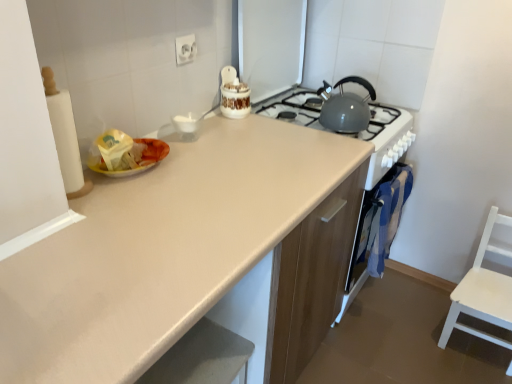
What are the coordinates of `blue fabric oven at right` in the screenshot? It's located at (378, 228).

The height and width of the screenshot is (384, 512). In order to click on matte gray kettle at upper right in this screenshot , I will do `click(345, 107)`.

Locate an element on the screen. The image size is (512, 384). white wood chair at right is located at coordinates (483, 292).

This screenshot has width=512, height=384. Find the location of `white plastic electric outlet at upper center`. white plastic electric outlet at upper center is located at coordinates (185, 49).

From a real-world perspective, is white wood chair at right located higher than white plastic electric outlet at upper center?

No.

From the image's perspective, is white wood chair at right positioned above or below white plastic electric outlet at upper center?

From the image's perspective, white wood chair at right appears below white plastic electric outlet at upper center.

Between point (479, 289) and point (192, 37), which one is positioned behind?

The point (479, 289) is farther from the camera.

Considering the positions of objects white wood chair at right and white plastic electric outlet at upper center in the image provided, who is more to the right, white wood chair at right or white plastic electric outlet at upper center?

From the viewer's perspective, white wood chair at right appears more on the right side.

Does white wood chair at right lie behind blue fabric oven at right?

That is False.

Is white wood chair at right oriented away from blue fabric oven at right?

No, white wood chair at right is not facing the opposite direction of blue fabric oven at right.

In terms of height, does matte gray kettle at upper right look taller or shorter compared to white plastic electric outlet at upper center?

matte gray kettle at upper right is taller than white plastic electric outlet at upper center.

Considering the relative positions of matte gray kettle at upper right and white plastic electric outlet at upper center in the image provided, is matte gray kettle at upper right behind white plastic electric outlet at upper center?

That is True.

In the scene shown: Does matte gray kettle at upper right appear on the right side of white plastic electric outlet at upper center?

Correct, you'll find matte gray kettle at upper right to the right of white plastic electric outlet at upper center.

Where is `kitchen appliance below the white plastic electric outlet at upper center (from the image's perspective)`? Image resolution: width=512 pixels, height=384 pixels. kitchen appliance below the white plastic electric outlet at upper center (from the image's perspective) is located at coordinates (345, 107).

Are white wood chair at right and matte beige countertop at center located far from each other?

Yes.

Looking at this image, is white wood chair at right in front of or behind matte beige countertop at center in the image?

white wood chair at right is behind matte beige countertop at center.

Considering the sizes of objects white wood chair at right and matte beige countertop at center in the image provided, who is shorter, white wood chair at right or matte beige countertop at center?

Standing shorter between the two is white wood chair at right.

Which object is positioned more to the left, white wood chair at right or matte beige countertop at center?

From the viewer's perspective, matte beige countertop at center appears more on the left side.

From the image's perspective, between matte beige countertop at center and white wood chair at right, which one is located above?

matte beige countertop at center, from the image's perspective.

Between matte beige countertop at center and white wood chair at right, which one has larger width?

Wider between the two is matte beige countertop at center.

Identify the location of countertop on the left of the white wood chair at right. coord(166,253).

Is point (195, 317) closer or farther from the camera than point (487, 339)?

Point (195, 317) appears to be closer to the viewer than point (487, 339).

Is matte gray kettle at upper right placed right next to matte beige countertop at center?

matte gray kettle at upper right and matte beige countertop at center are not in contact.

From a real-world perspective, is matte gray kettle at upper right physically below matte beige countertop at center?

No, from a real-world perspective, matte gray kettle at upper right is not below matte beige countertop at center.

Is matte gray kettle at upper right at the right side of matte beige countertop at center?

Indeed, matte gray kettle at upper right is positioned on the right side of matte beige countertop at center.

Do you think matte gray kettle at upper right is within matte beige countertop at center, or outside of it?

matte gray kettle at upper right is outside matte beige countertop at center.

Does white wood chair at right have a lesser width compared to matte gray kettle at upper right?

No, white wood chair at right is not thinner than matte gray kettle at upper right.

Considering the positions of objects white wood chair at right and matte gray kettle at upper right in the image provided, who is more to the right, white wood chair at right or matte gray kettle at upper right?

white wood chair at right.

Which of these two, white wood chair at right or matte gray kettle at upper right, stands shorter?

matte gray kettle at upper right.

From a real-world perspective, is white wood chair at right below matte gray kettle at upper right?

Correct, in the physical world, white wood chair at right is lower than matte gray kettle at upper right.

At what (x,y) coordinates should I click in order to perform the action: click on electric outlet in front of the white wood chair at right. Please return your answer as a coordinate pair (x, y). Image resolution: width=512 pixels, height=384 pixels. Looking at the image, I should click on (185, 49).

Find the location of `chair that appears below the blue fabric oven at right (from the image's perspective)`. chair that appears below the blue fabric oven at right (from the image's perspective) is located at coordinates (483, 292).

Based on their spatial positions, is white plastic electric outlet at upper center or matte gray kettle at upper right closer to matte beige countertop at center?

matte gray kettle at upper right.

Estimate the real-world distances between objects in this image. Which object is closer to matte gray kettle at upper right, blue fabric oven at right or white plastic electric outlet at upper center?

blue fabric oven at right lies closer to matte gray kettle at upper right than the other object.

Estimate the real-world distances between objects in this image. Which object is closer to white plastic electric outlet at upper center, matte gray kettle at upper right or matte beige countertop at center?

matte gray kettle at upper right lies closer to white plastic electric outlet at upper center than the other object.

Which object lies further to the anchor point white wood chair at right, blue fabric oven at right or white plastic electric outlet at upper center?

white plastic electric outlet at upper center is further to white wood chair at right.

When comparing their distances from matte gray kettle at upper right, does white wood chair at right or matte beige countertop at center seem closer?

matte beige countertop at center.

Looking at the image, which one is located closer to matte beige countertop at center, blue fabric oven at right or white plastic electric outlet at upper center?

blue fabric oven at right is positioned closer to the anchor matte beige countertop at center.

Estimate the real-world distances between objects in this image. Which object is further from white plastic electric outlet at upper center, blue fabric oven at right or white wood chair at right?

The object further to white plastic electric outlet at upper center is white wood chair at right.

Considering their positions, is white wood chair at right positioned closer to blue fabric oven at right than matte gray kettle at upper right?

white wood chair at right lies closer to blue fabric oven at right than the other object.

Locate an element on the screen. This screenshot has width=512, height=384. oven located between white plastic electric outlet at upper center and white wood chair at right in the left-right direction is located at coordinates [x=378, y=228].

You are a GUI agent. You are given a task and a screenshot of the screen. Output one action in this format:
    pyautogui.click(x=<x>, y=<y>)
    Task: Click on the kitchen appliance between white plastic electric outlet at upper center and white wood chair at right from left to right
    
    Given the screenshot: What is the action you would take?
    point(345,107)

The width and height of the screenshot is (512, 384). Identify the location of electric outlet between matte beige countertop at center and blue fabric oven at right from front to back. (185, 49).

The image size is (512, 384). What are the coordinates of `countertop between white plastic electric outlet at upper center and white wood chair at right` in the screenshot? It's located at (166, 253).